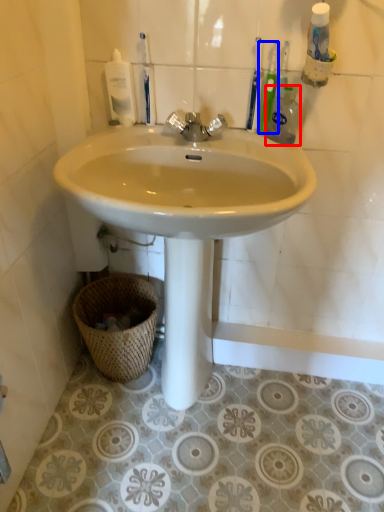
Question: Which point is closer to the camera, cleaning product (highlighted by a red box) or toothbrush (highlighted by a blue box)?

Choices:
 (A) cleaning product
 (B) toothbrush

Answer: (A)